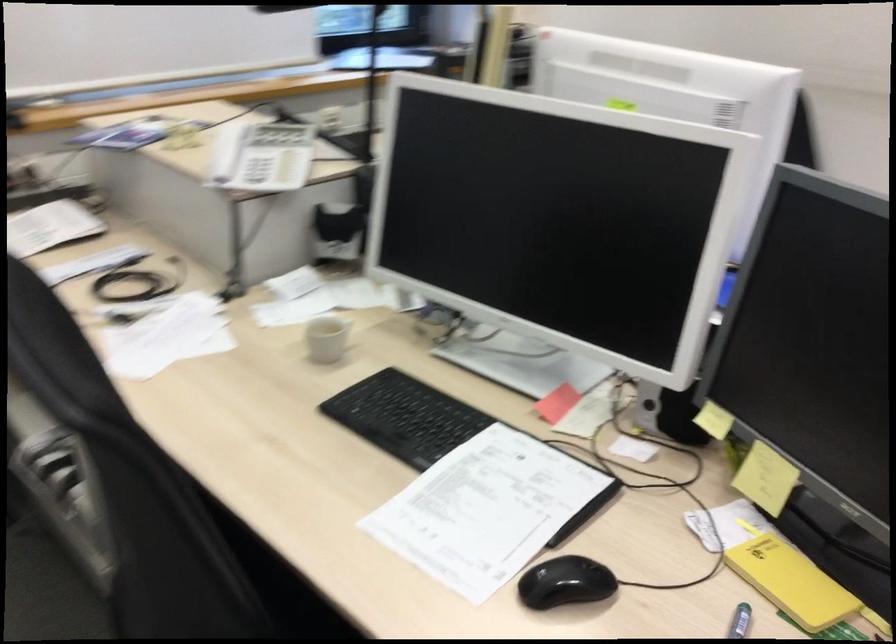
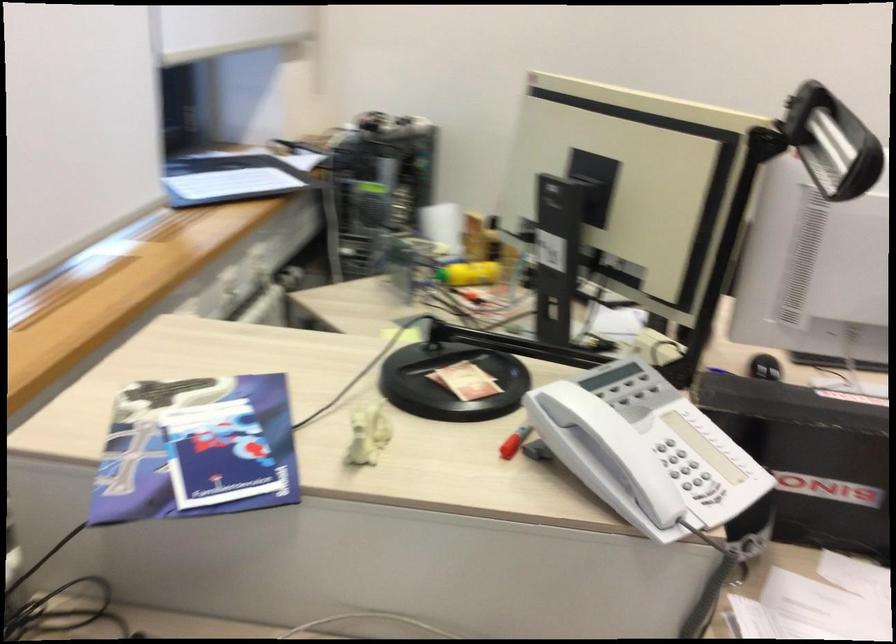
Locate, in the second image, the point that corresponds to [124,135] in the first image.

(195, 450)